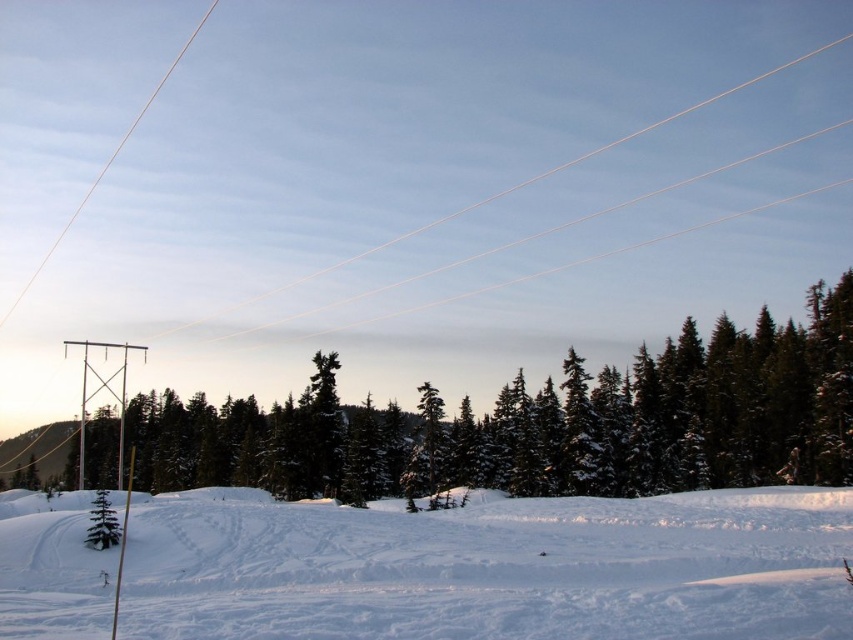
Question: Is white powdery snow at lower center to the left of green matte tree at lower left from the viewer's perspective?

Choices:
 (A) no
 (B) yes

Answer: (A)

Question: Considering the real-world distances, which object is closest to the white wire at upper center?

Choices:
 (A) green matte tree at lower left
 (B) white wire at upper left

Answer: (B)

Question: Is white powdery snow at lower center thinner than green matte tree at center?

Choices:
 (A) no
 (B) yes

Answer: (B)

Question: Which point is farther to the camera?

Choices:
 (A) green matte tree at lower left
 (B) green matte tree at center
 (C) white wire at upper center
 (D) white powdery snow at lower center

Answer: (C)

Question: Which point is closer to the camera?

Choices:
 (A) white wire at upper center
 (B) green matte tree at lower left

Answer: (B)

Question: Is white powdery snow at lower center smaller than white wire at upper center?

Choices:
 (A) yes
 (B) no

Answer: (A)